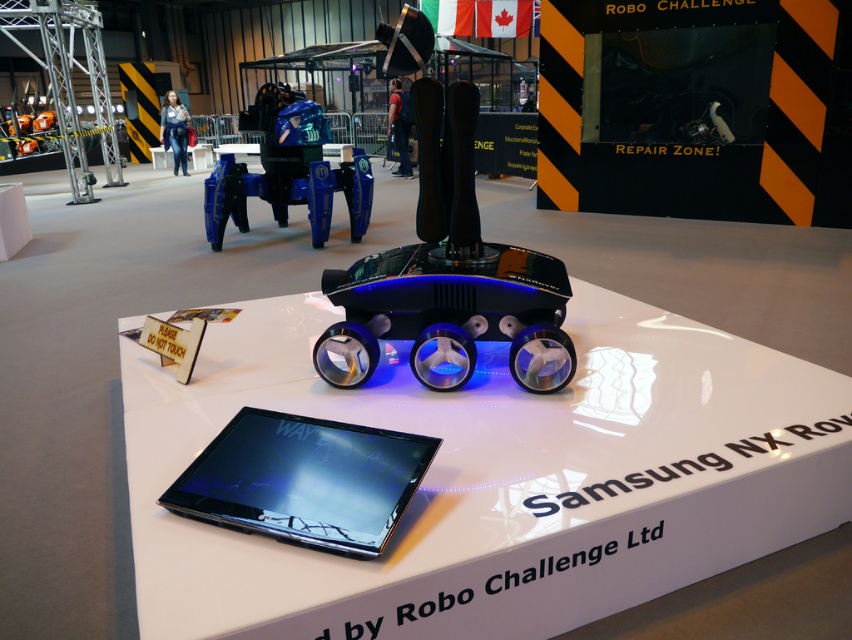
Based on the photo, between matte black tablet at center and metallic blue robot at upper center, which one appears on the right side from the viewer's perspective?

From the viewer's perspective, matte black tablet at center appears more on the right side.

Can you confirm if matte black tablet at center is bigger than metallic blue robot at upper center?

Actually, matte black tablet at center might be smaller than metallic blue robot at upper center.

Is point (216, 444) positioned after point (324, 225)?

No, it is in front of (324, 225).

You are a GUI agent. You are given a task and a screenshot of the screen. Output one action in this format:
    pyautogui.click(x=<x>, y=<y>)
    Task: Click on the matte black tablet at center
    Image resolution: width=852 pixels, height=640 pixels.
    Given the screenshot: What is the action you would take?
    pyautogui.click(x=304, y=481)

Who is lower down, transparent plastic rover at center or matte black tablet at center?

matte black tablet at center is lower down.

Which of these two, transparent plastic rover at center or matte black tablet at center, stands taller?

transparent plastic rover at center is taller.

Is point (492, 321) positioned behind point (350, 451)?

Yes, point (492, 321) is farther from viewer.

Identify the location of transparent plastic rover at center. (448, 314).

In the scene shown: Which is above, transparent plastic rover at center or metallic blue robot at upper center?

Positioned higher is metallic blue robot at upper center.

Describe the element at coordinates (448, 314) in the screenshot. I see `transparent plastic rover at center` at that location.

Identify the location of transparent plastic rover at center. Image resolution: width=852 pixels, height=640 pixels. [x=448, y=314].